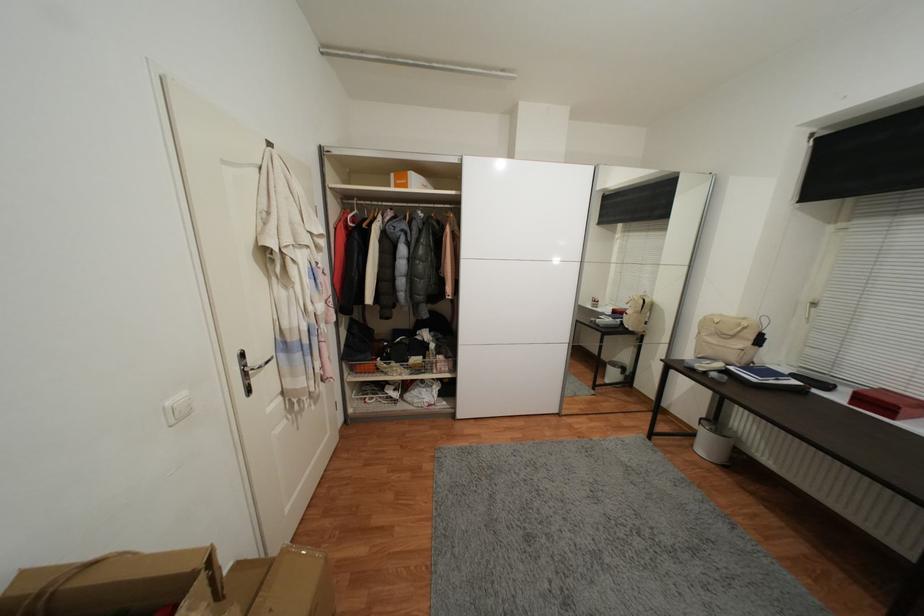
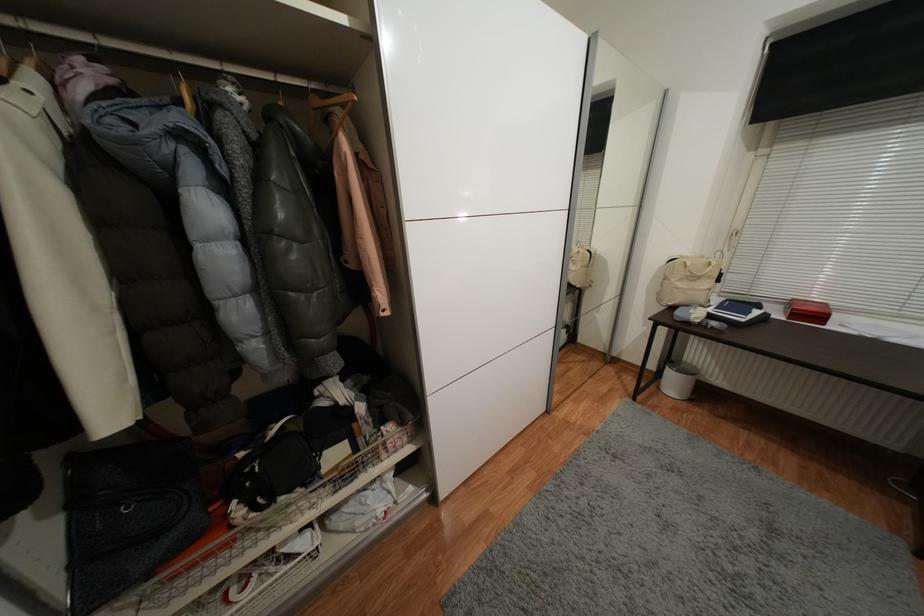
Find the pixel in the second image that matches [416,376] in the first image.

(342, 493)